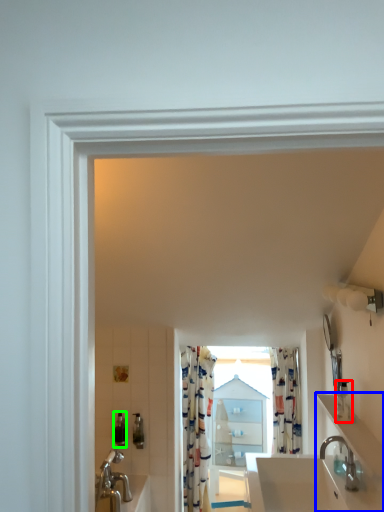
Question: Based on their relative distances, which object is farther from toiletry (highlighted by a red box)? Choose from counter top (highlighted by a blue box) and toiletry (highlighted by a green box).

Choices:
 (A) counter top
 (B) toiletry

Answer: (B)